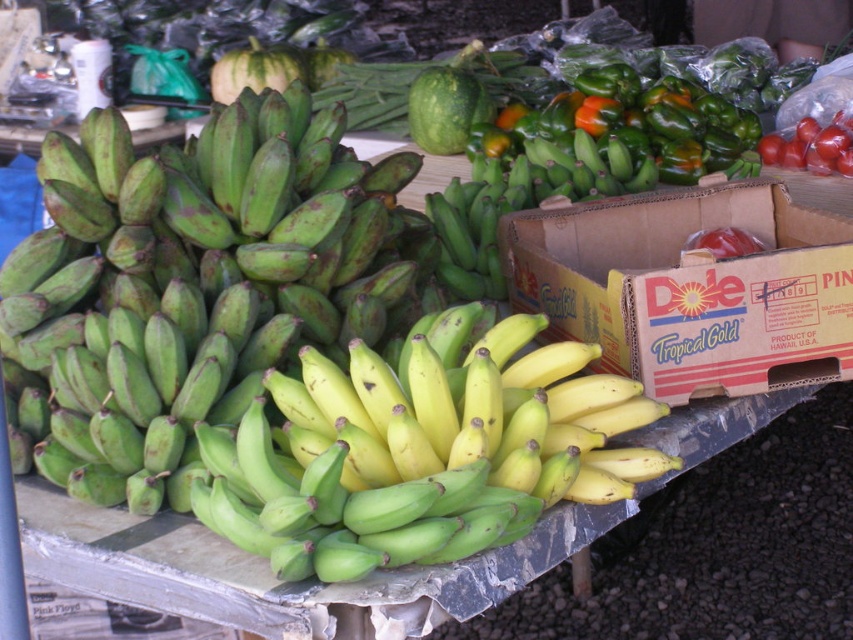
Question: Which is farther from the green matte bananas at center?

Choices:
 (A) shiny red tomatoes at upper right
 (B) red matte tomato at center
 (C) cardboard box at right

Answer: (A)

Question: Which of the following is the farthest from the observer?

Choices:
 (A) cardboard box at right
 (B) green matte pepper at upper center
 (C) red matte tomato at center

Answer: (B)

Question: In this image, where is green matte bananas at left located relative to cardboard box at right?

Choices:
 (A) left
 (B) right

Answer: (A)

Question: Does cardboard box at right appear on the left side of green matte pepper at upper center?

Choices:
 (A) yes
 (B) no

Answer: (B)

Question: Which object is positioned farthest from the red matte tomato at center?

Choices:
 (A) shiny red tomatoes at upper right
 (B) cardboard box at right
 (C) green matte bananas at left
 (D) green matte pepper at upper center

Answer: (A)

Question: Is green matte bananas at left wider than cardboard box at right?

Choices:
 (A) yes
 (B) no

Answer: (A)